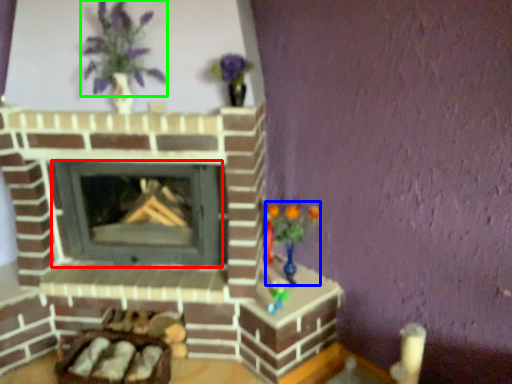
Question: Estimate the real-world distances between objects in this image. Which object is closer to wood burning stove (highlighted by a red box), toy (highlighted by a blue box) or floral arrangement (highlighted by a green box)?

Choices:
 (A) toy
 (B) floral arrangement

Answer: (A)